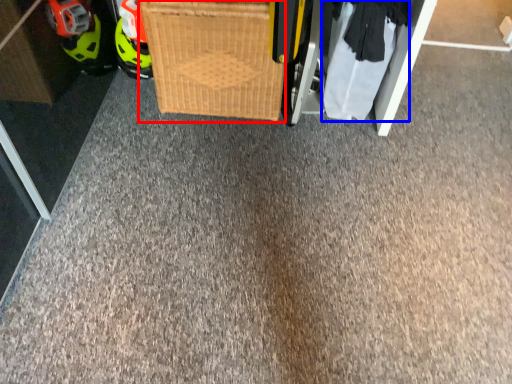
Question: Which object is closer to the camera taking this photo, basket (highlighted by a red box) or clothing (highlighted by a blue box)?

Choices:
 (A) basket
 (B) clothing

Answer: (A)